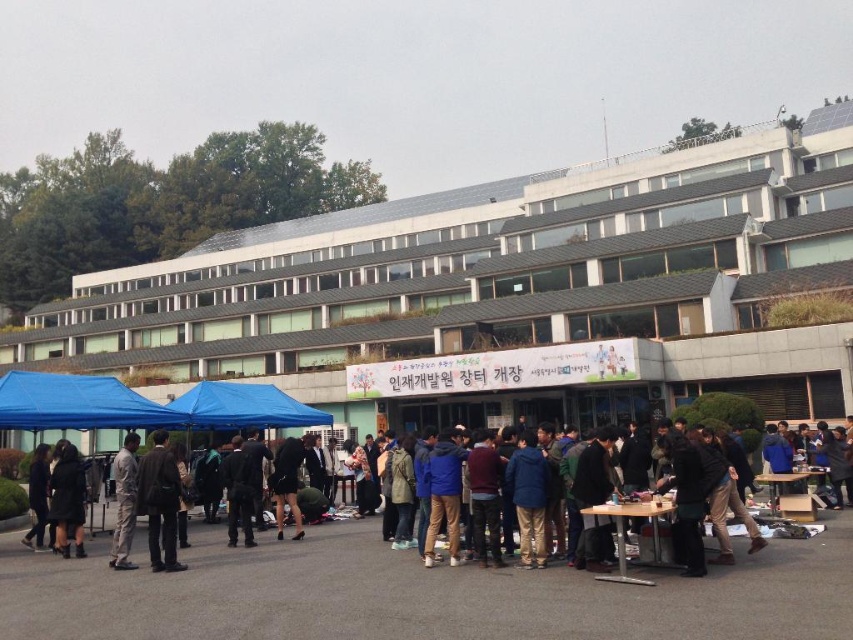
You are a photographer standing at the entrance of the building and want to capture both the dark brown leather jacket at center and the dark blue jacket at center in a single frame. Which jacket will appear wider in the photo?

The dark blue jacket at center will appear wider in the photo because the dark brown leather jacket at center has a lesser width compared to it.

You are a photographer setting up equipment for an event at the university building. You notice the blue fabric canopy at lower left and the light gray fabric pants at lower left. Which object is above the other?

The blue fabric canopy at lower left is positioned over the light gray fabric pants at lower left, so the blue fabric canopy is above the light gray fabric pants.